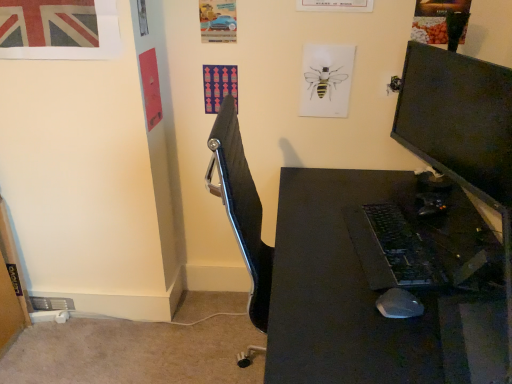
Locate an element on the screen. The image size is (512, 384). vacant location behind black plastic mouse at lower right is located at coordinates (374, 271).